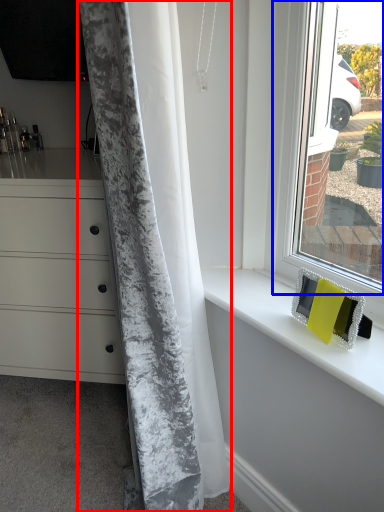
Question: Which of the following is the closest to the observer, curtain (highlighted by a red box) or window (highlighted by a blue box)?

Choices:
 (A) curtain
 (B) window

Answer: (A)